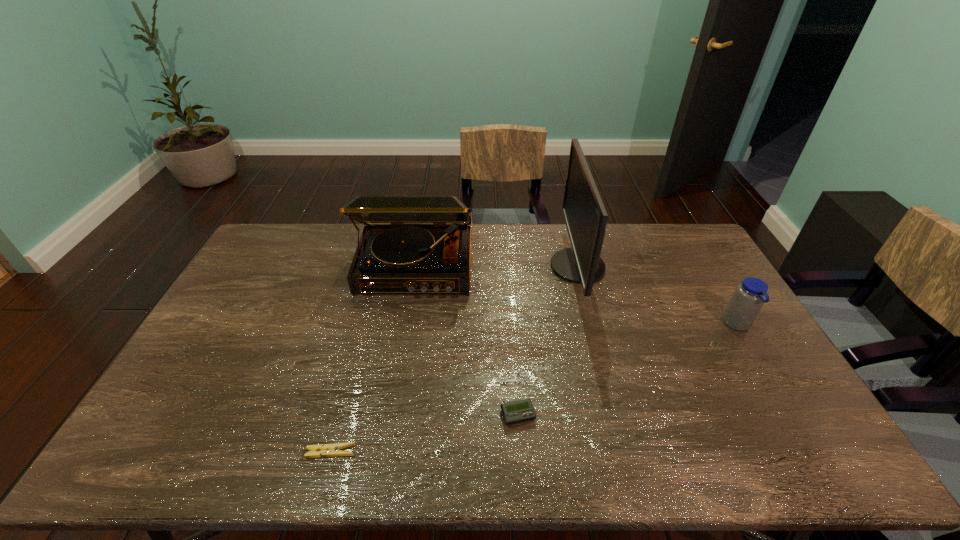
Find the location of a particular element. The width and height of the screenshot is (960, 540). object located at the near edge is located at coordinates (328, 450).

Image resolution: width=960 pixels, height=540 pixels. Find the location of `object present at the right edge`. object present at the right edge is located at coordinates (749, 296).

The height and width of the screenshot is (540, 960). What are the coordinates of `vacant area at the far edge` in the screenshot? It's located at (622, 239).

At what (x,y) coordinates should I click in order to perform the action: click on vacant region at the near edge. Please return your answer as a coordinate pair (x, y). Image resolution: width=960 pixels, height=540 pixels. Looking at the image, I should click on (684, 458).

Identify the location of vacant space at the right edge. (680, 265).

The height and width of the screenshot is (540, 960). In the image, there is a desktop. What are the coordinates of `free space at the near left corner` in the screenshot? It's located at (140, 455).

Identify the location of free space at the far right corner. The image size is (960, 540). (651, 225).

I want to click on free space at the near right corner of the desktop, so click(x=772, y=442).

Locate an element on the screen. This screenshot has width=960, height=540. free space between the clothespin and the rightmost object is located at coordinates (534, 388).

Where is `empty space between the fourth object from left to right and the clothespin`? The height and width of the screenshot is (540, 960). empty space between the fourth object from left to right and the clothespin is located at coordinates (454, 359).